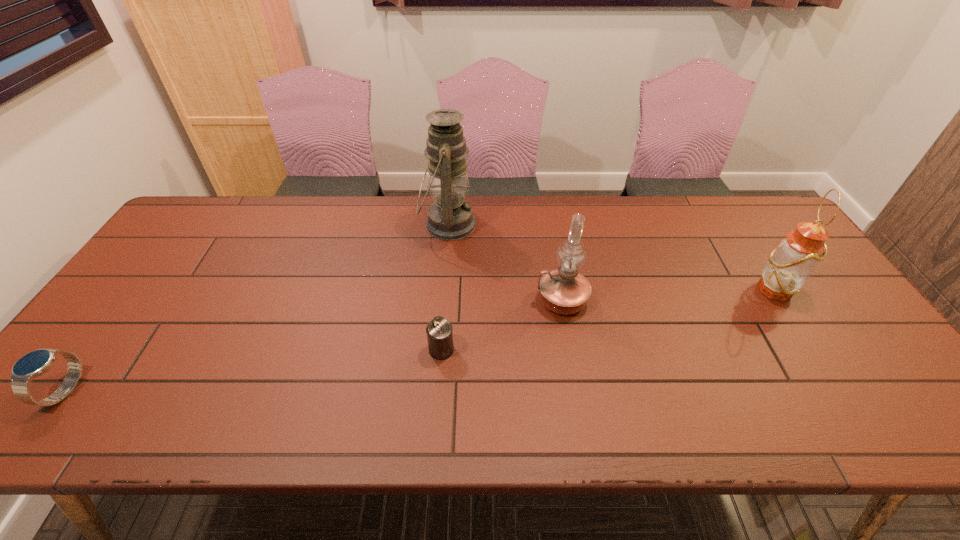
Locate an element on the screen. free space located on the right of the nearest object is located at coordinates (139, 390).

The height and width of the screenshot is (540, 960). In order to click on free space located on the right of the can in this screenshot , I will do `click(581, 349)`.

Identify the location of object at the far edge. This screenshot has height=540, width=960. (450, 217).

Where is `object at the near edge`? The image size is (960, 540). object at the near edge is located at coordinates (36, 363).

Where is `object located in the left edge section of the desktop`? object located in the left edge section of the desktop is located at coordinates (36, 363).

Locate an element on the screen. This screenshot has height=540, width=960. object located in the right edge section of the desktop is located at coordinates (789, 266).

The width and height of the screenshot is (960, 540). I want to click on object present at the near left corner, so pos(36,363).

The image size is (960, 540). In order to click on vacant area at the far edge in this screenshot , I will do `click(499, 226)`.

The height and width of the screenshot is (540, 960). In the image, there is a desktop. What are the coordinates of `vacant space at the near edge` in the screenshot? It's located at point(690,413).

In the image, there is a desktop. Find the location of `vacant space at the left edge`. vacant space at the left edge is located at coordinates (114, 373).